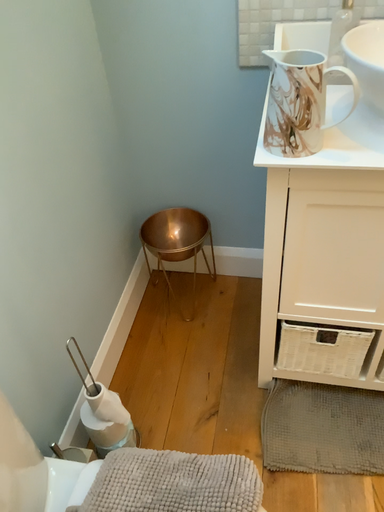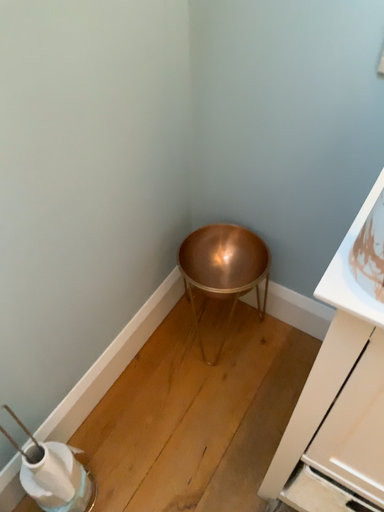
Question: How did the camera likely rotate when shooting the video?

Choices:
 (A) rotated left
 (B) rotated right

Answer: (A)